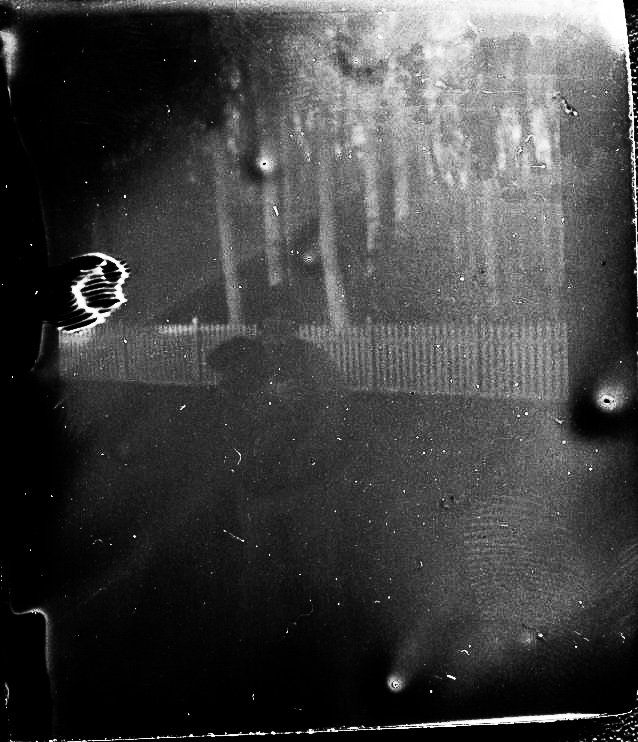
Locate an element on the screen. mirror is located at coordinates (167, 495).